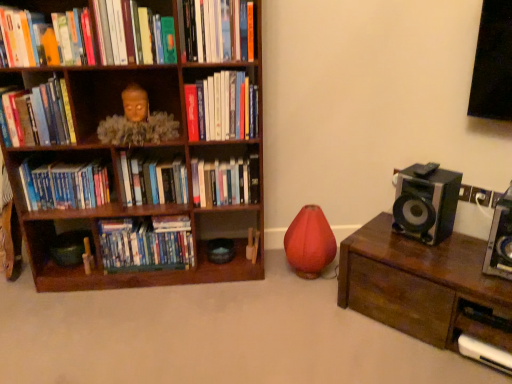
This screenshot has height=384, width=512. I want to click on empty space that is to the right of brown wooden bookcase at left, so click(284, 307).